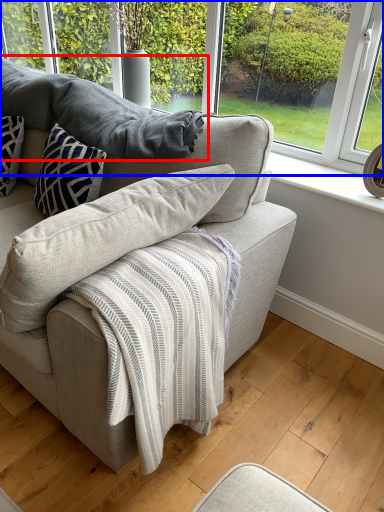
Question: Which object is closer to the camera taking this photo, gray (highlighted by a red box) or window (highlighted by a blue box)?

Choices:
 (A) gray
 (B) window

Answer: (A)